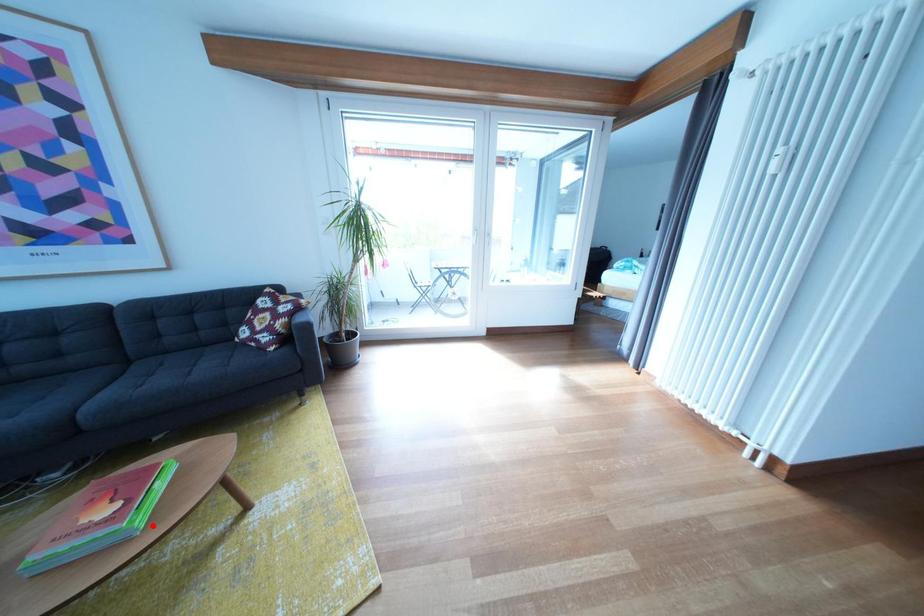
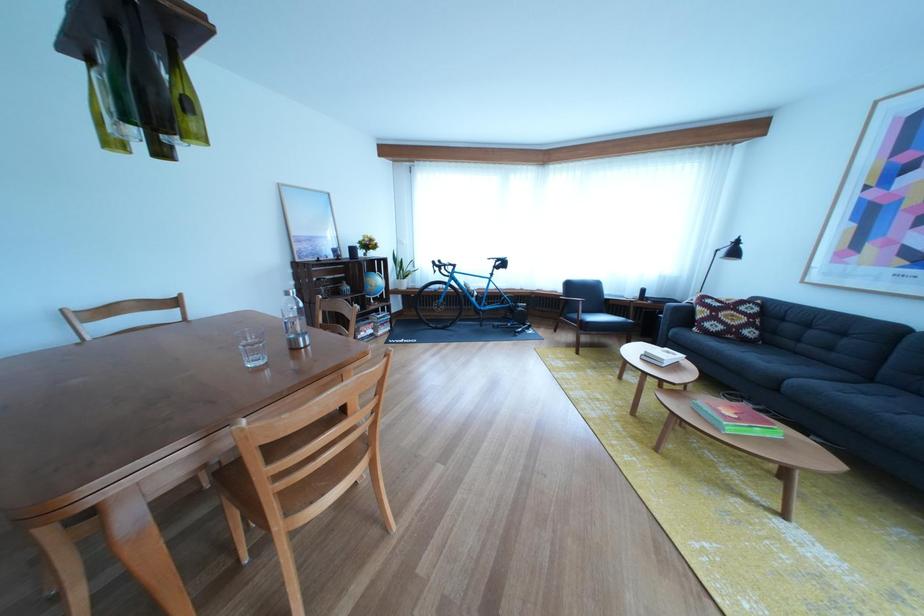
Locate, in the second image, the point that corresponds to the highlighted location in the first image.

(744, 435)